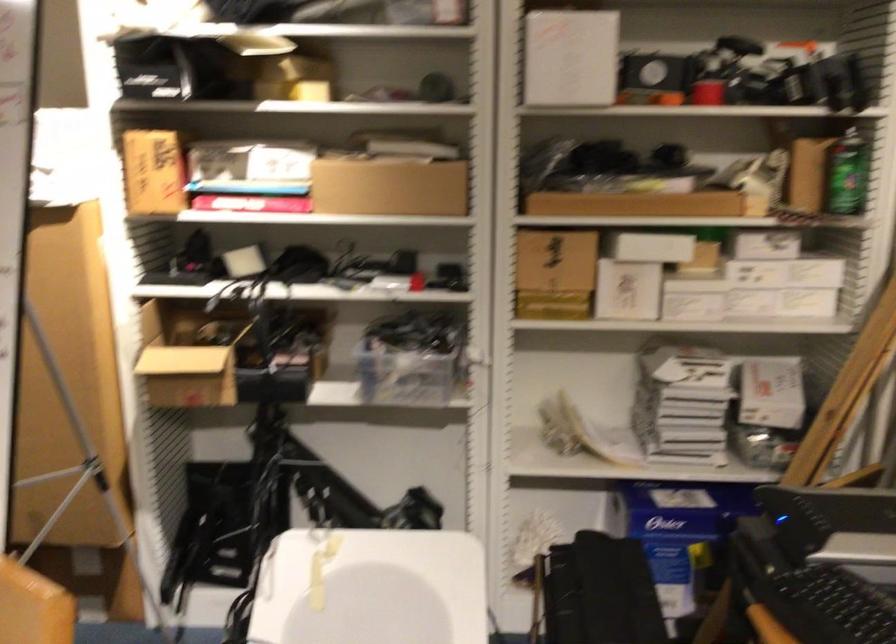
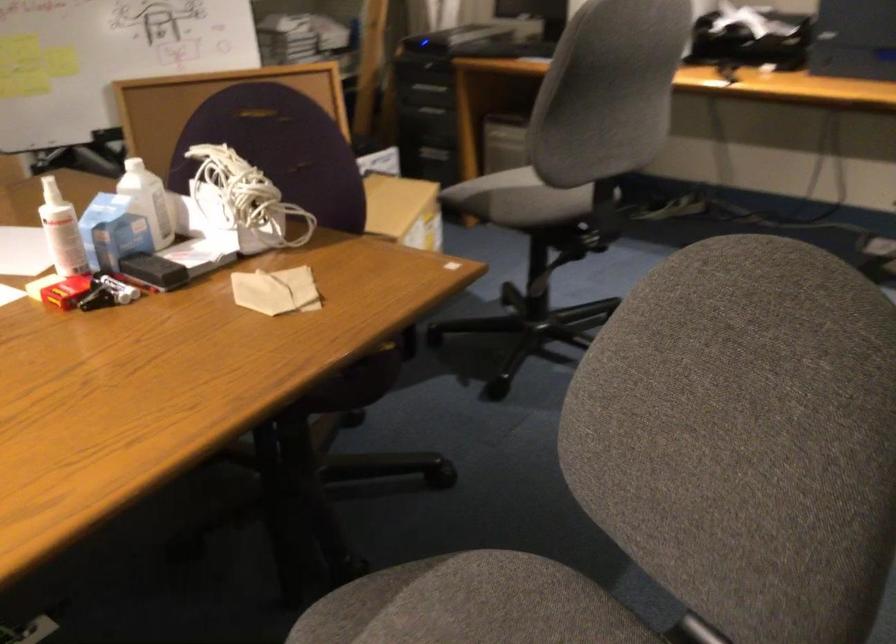
Question: I am providing you with two images of the same scene from different viewpoints. Please identify which objects are invisible in image2.

Choices:
 (A) white square box
 (B) brown paper napkin
 (C) empty cardboard roll
 (D) black stapler

Answer: (A)